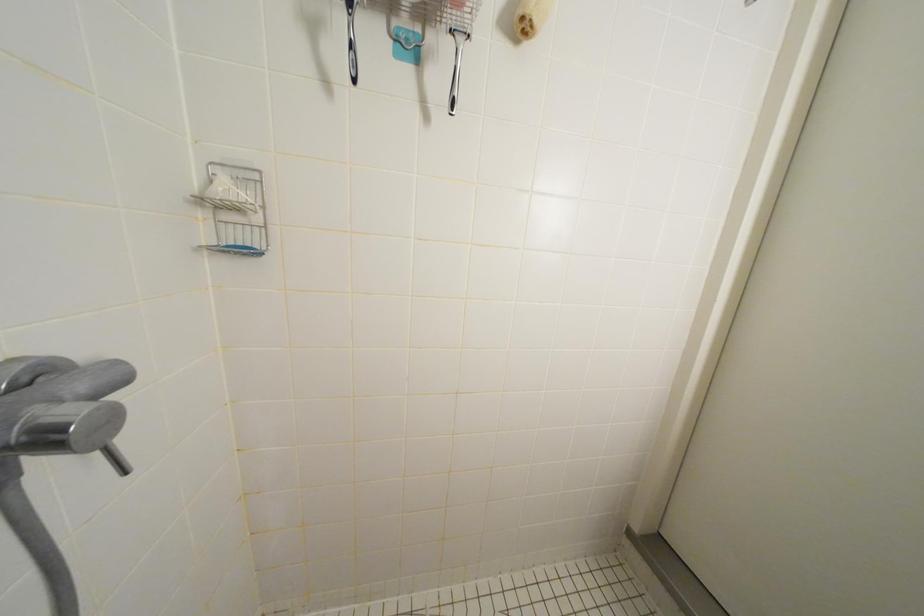
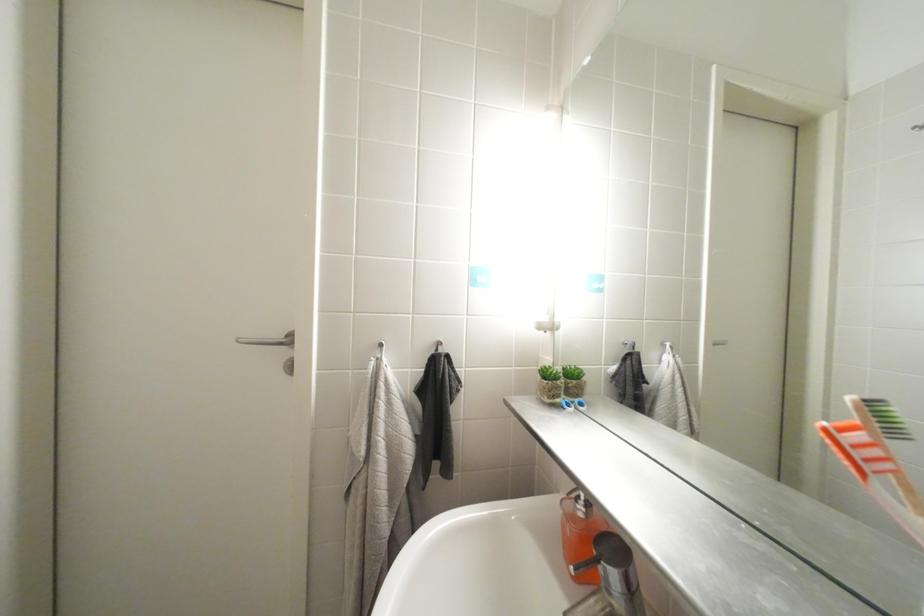
Question: The camera is either moving clockwise (left) or counter-clockwise (right) around the object. The first image is from the beginning of the video and the second image is from the end. Is the camera moving left or right when shooting the video?

Choices:
 (A) Left
 (B) Right

Answer: (A)